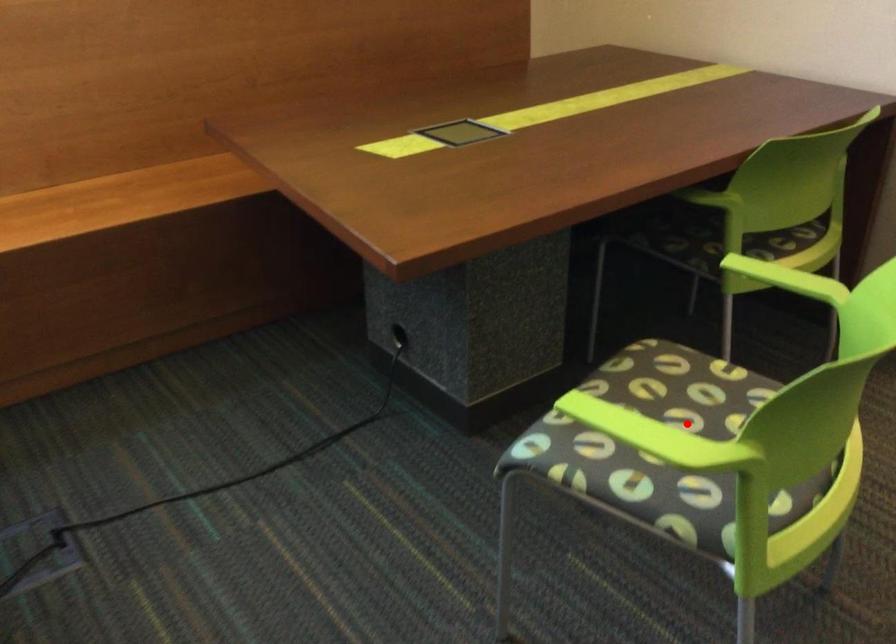
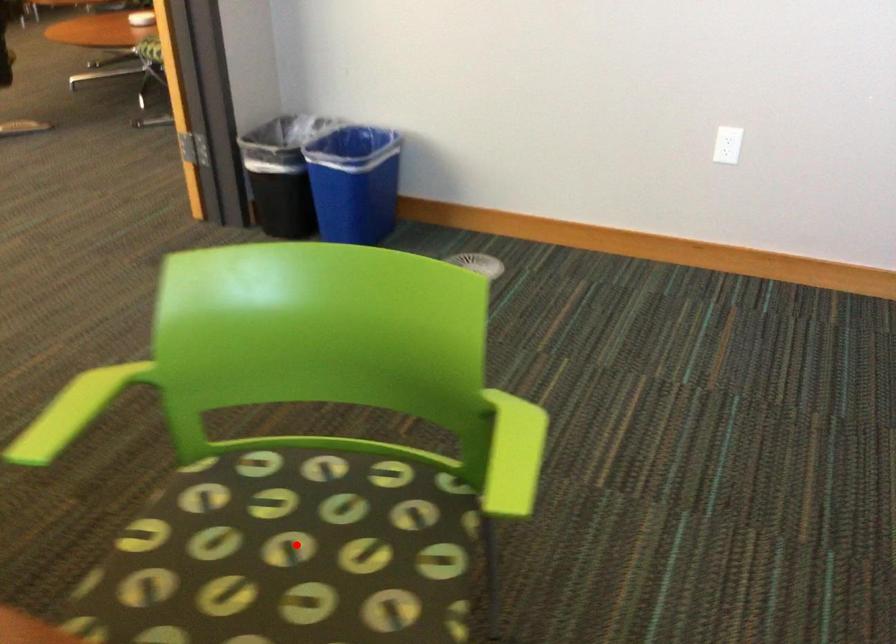
I am providing you with two images of the same scene from different viewpoints. A red point is marked on the first image and another point is marked on the second image. Does the point marked in image1 correspond to the same location as the one in image2?

Yes